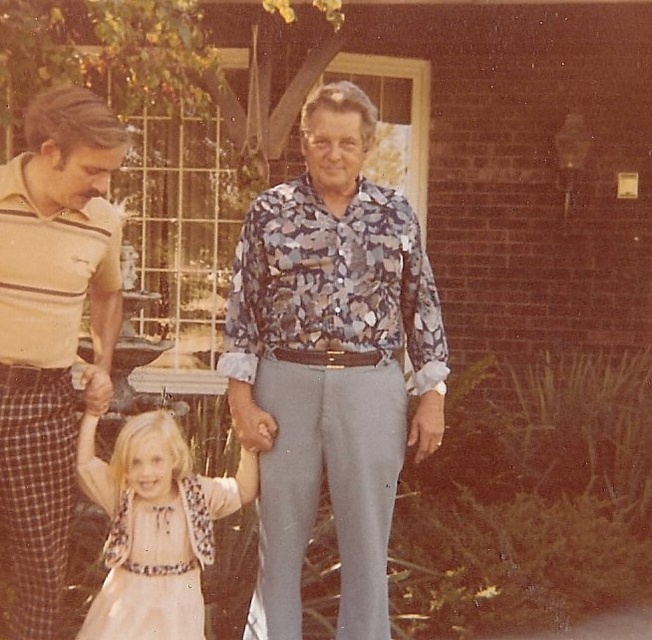
Question: Is striped cotton shirt at left further to camera compared to pastel pink satin dress at center?

Choices:
 (A) no
 (B) yes

Answer: (A)

Question: Which of these objects is positioned closest to the floral print shirt at center?

Choices:
 (A) pastel pink satin dress at center
 (B) striped cotton shirt at left

Answer: (A)

Question: Which object is positioned farthest from the striped cotton shirt at left?

Choices:
 (A) floral print shirt at center
 (B) pastel pink satin dress at center

Answer: (A)

Question: Which of the following is the closest to the observer?

Choices:
 (A) (303, 134)
 (B) (128, 474)

Answer: (A)

Question: Observing the image, what is the correct spatial positioning of striped cotton shirt at left in reference to pastel pink satin dress at center?

Choices:
 (A) below
 (B) above

Answer: (B)

Question: Does floral print shirt at center appear over striped cotton shirt at left?

Choices:
 (A) yes
 (B) no

Answer: (B)